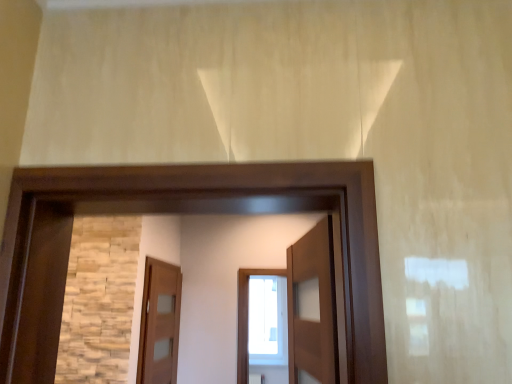
Describe the element at coordinates (161, 324) in the screenshot. I see `matte wood door at center` at that location.

Where is `matte wood door at center`? matte wood door at center is located at coordinates (161, 324).

This screenshot has height=384, width=512. Identify the location of matte wood door at center. (161, 324).